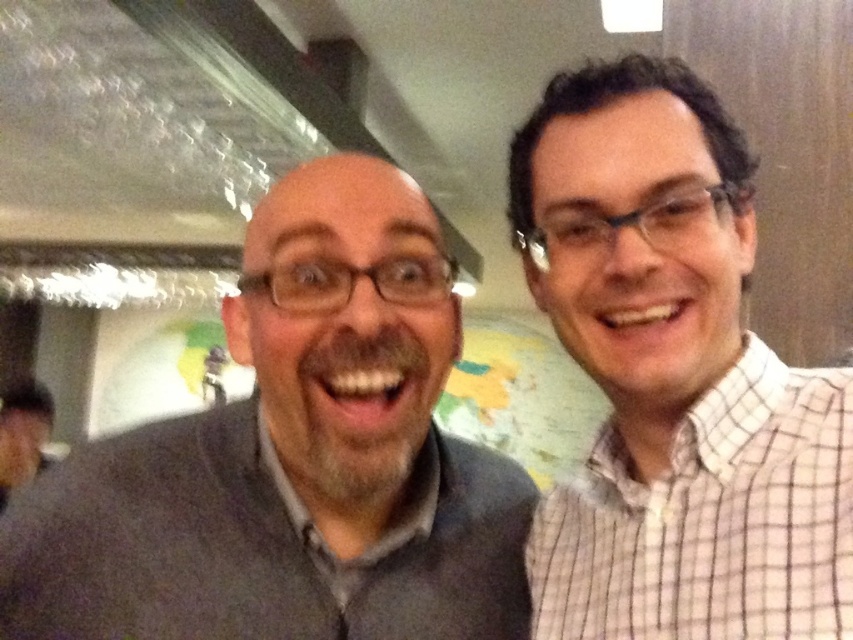
Who is positioned more to the left, gray sweater at left or white checkered shirt at right?

From the viewer's perspective, gray sweater at left appears more on the left side.

Is gray sweater at left bigger than white checkered shirt at right?

Yes, gray sweater at left is bigger than white checkered shirt at right.

Measure the distance between gray sweater at left and camera.

gray sweater at left and camera are 20.68 inches apart from each other.

Where is `gray sweater at left`? This screenshot has width=853, height=640. gray sweater at left is located at coordinates (293, 458).